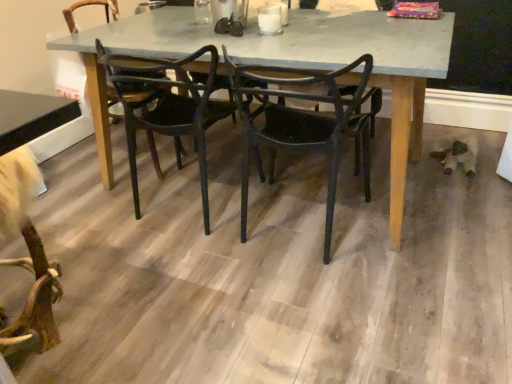
Question: Based on their positions, is black matte chair at center, the first chair from the right, located to the left or right of wooden floor at center?

Choices:
 (A) right
 (B) left

Answer: (A)

Question: Considering the positions of black matte chair at center, the first chair from the right, and wooden floor at center in the image, is black matte chair at center, the first chair from the right, taller or shorter than wooden floor at center?

Choices:
 (A) short
 (B) tall

Answer: (B)

Question: Which object is the closest to the black matte chair at center, positioned as the second chair in left-to-right order?

Choices:
 (A) wooden floor at center
 (B) matte gray table at center
 (C) black plastic chair at center, the second chair when ordered from right to left

Answer: (B)

Question: Which object is the farthest from the wooden floor at center?

Choices:
 (A) matte gray table at center
 (B) black matte chair at center, the first chair from the right
 (C) black plastic chair at center, the second chair when ordered from right to left

Answer: (C)